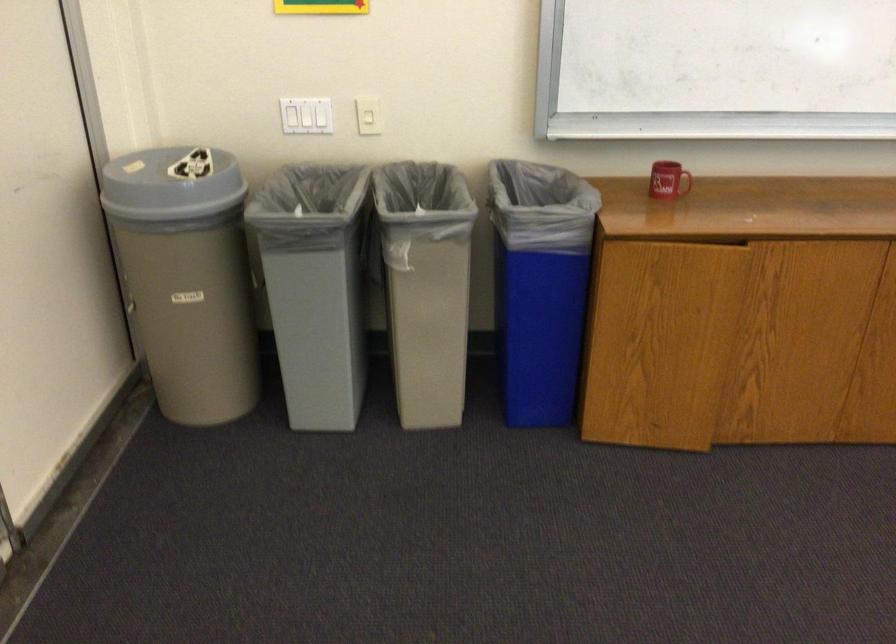
The image size is (896, 644). What do you see at coordinates (186, 277) in the screenshot?
I see `the light gray trash can` at bounding box center [186, 277].